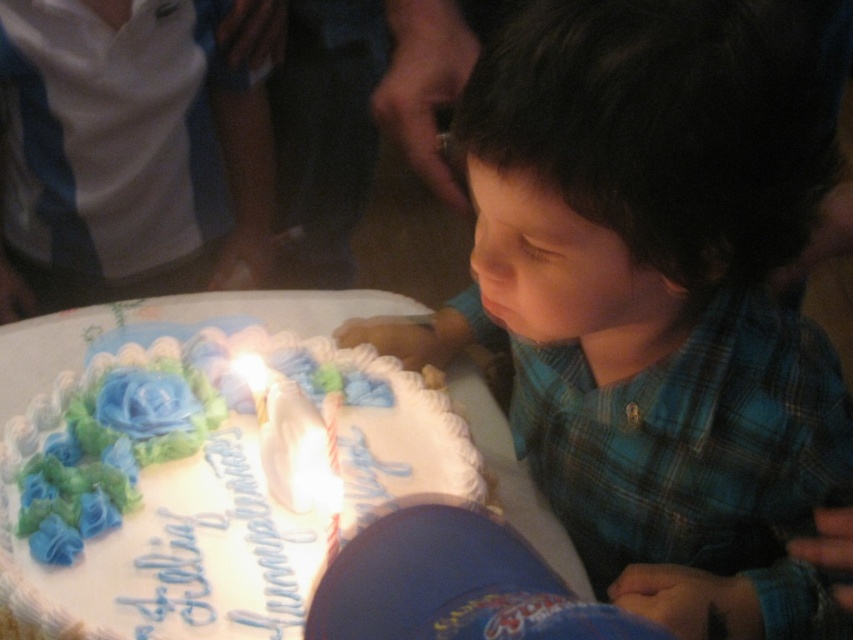
Question: Can you confirm if white frosted cake at lower left is thinner than white wax candle at center?

Choices:
 (A) yes
 (B) no

Answer: (B)

Question: Which point is closer to the camera?

Choices:
 (A) (393, 422)
 (B) (579, 122)
 (C) (282, 397)

Answer: (B)

Question: Can you confirm if blue plaid shirt at center is smaller than white frosted cake at lower left?

Choices:
 (A) no
 (B) yes

Answer: (A)

Question: Among these points, which one is nearest to the camera?

Choices:
 (A) (287, 445)
 (B) (74, 404)
 (C) (648, 356)

Answer: (A)

Question: Considering the relative positions of blue plaid shirt at center and white frosted cake at lower left in the image provided, where is blue plaid shirt at center located with respect to white frosted cake at lower left?

Choices:
 (A) below
 (B) above

Answer: (B)

Question: Which of the following is the farthest from the observer?

Choices:
 (A) white frosted cake at lower left
 (B) blue plaid shirt at center

Answer: (A)